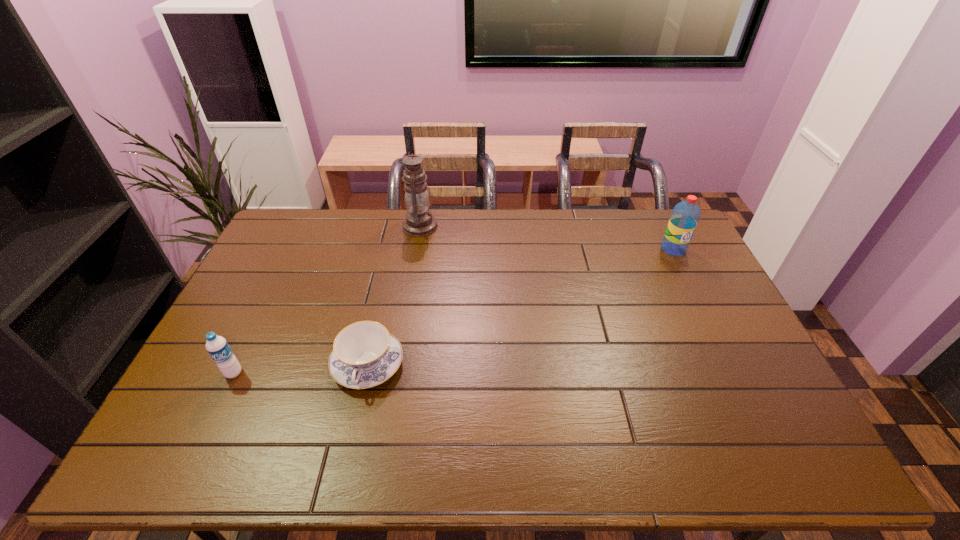
Where is `free point at the near left corner`? free point at the near left corner is located at coordinates (161, 466).

Where is `vacant area at the far right corner`? Image resolution: width=960 pixels, height=540 pixels. vacant area at the far right corner is located at coordinates (670, 219).

Locate an element on the screen. The image size is (960, 540). free space that is in between the oil lamp and the nearer water bottle is located at coordinates click(327, 300).

Identify the location of free area in between the oil lamp and the shortest object. (394, 295).

The width and height of the screenshot is (960, 540). Identify the location of free point between the chinaware and the second farthest object. (520, 307).

Image resolution: width=960 pixels, height=540 pixels. What are the coordinates of `blank region between the tallest object and the chinaware` in the screenshot? It's located at (394, 295).

Find the location of a particular element. free point between the chinaware and the leftmost object is located at coordinates (300, 369).

Identify the location of unoccupied area between the left water bottle and the third nearest object. The width and height of the screenshot is (960, 540). [x=453, y=311].

Image resolution: width=960 pixels, height=540 pixels. Find the location of `free space between the right water bottle and the leftmost object`. free space between the right water bottle and the leftmost object is located at coordinates (453, 311).

In order to click on free area in between the shortest object and the second shortest object in this screenshot , I will do `click(300, 369)`.